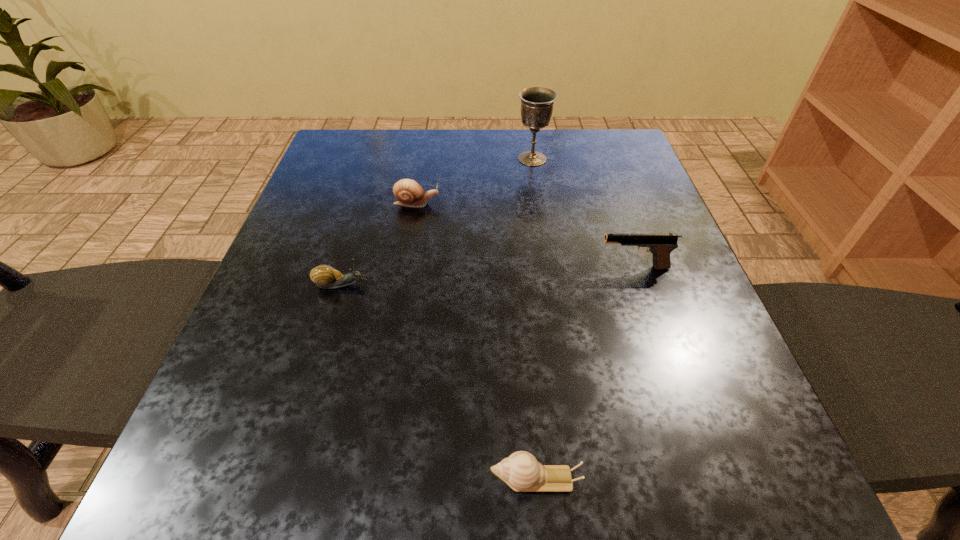
Where is `vacant space in between the farthest escargot and the pistol`? vacant space in between the farthest escargot and the pistol is located at coordinates (525, 235).

You are a GUI agent. You are given a task and a screenshot of the screen. Output one action in this format:
    pyautogui.click(x=<x>, y=<y>)
    Task: Click on the free space between the leftmost escargot and the rightmost object
    
    Given the screenshot: What is the action you would take?
    pyautogui.click(x=488, y=276)

You are a GUI agent. You are given a task and a screenshot of the screen. Output one action in this format:
    pyautogui.click(x=<x>, y=<y>)
    Task: Click on the free space between the second farthest escargot and the farthest escargot
    The image size is (960, 540).
    Given the screenshot: What is the action you would take?
    pyautogui.click(x=379, y=244)

The width and height of the screenshot is (960, 540). Find the location of `free point between the rightmost escargot and the second nearest object`. free point between the rightmost escargot and the second nearest object is located at coordinates [x=439, y=382].

Locate an element on the screen. The image size is (960, 540). vacant space in between the rightmost object and the leftmost escargot is located at coordinates (488, 276).

I want to click on free spot between the farthest object and the second nearest object, so click(x=437, y=221).

Identify the location of free space between the rightmost escargot and the farthest escargot. (476, 341).

What are the coordinates of `free spot between the pistol and the farthest object` in the screenshot? It's located at (583, 213).

Locate an element on the screen. vacant area that lies between the tallest object and the second farthest object is located at coordinates pos(474,181).

You are a GUI agent. You are given a task and a screenshot of the screen. Output one action in this format:
    pyautogui.click(x=<x>, y=<y>)
    Task: Click on the object that is the second closest to the farthest escargot
    The height and width of the screenshot is (540, 960).
    Given the screenshot: What is the action you would take?
    pyautogui.click(x=537, y=103)